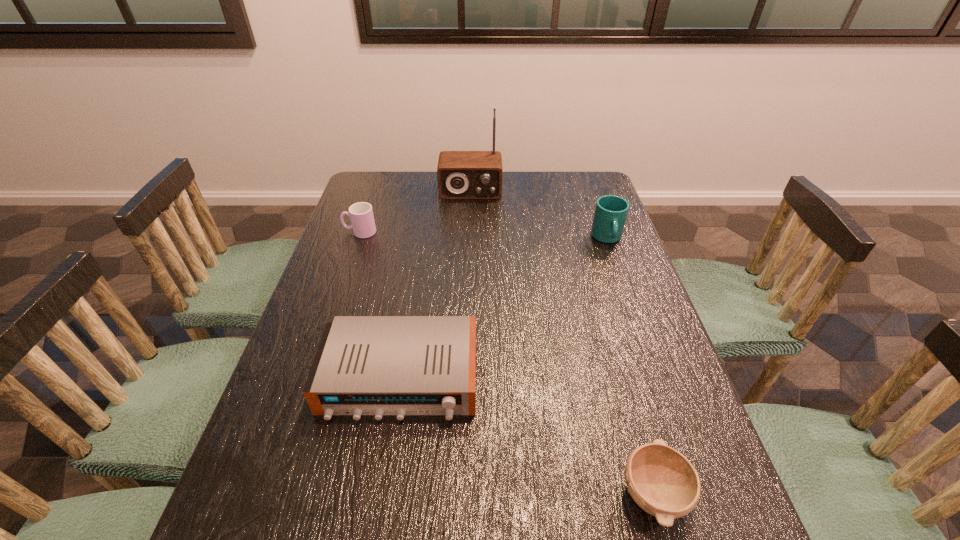
The height and width of the screenshot is (540, 960). What are the coordinates of `vacant space that's between the taller cup and the bowl` in the screenshot? It's located at (630, 366).

This screenshot has height=540, width=960. What are the coordinates of `free space between the left cup and the farther radio receiver` in the screenshot? It's located at (416, 212).

Choose which object is the second nearest neighbor to the shorter radio receiver. Please provide its 2D coordinates. Your answer should be formatted as a tuple, i.e. [(x, y)], where the tuple contains the x and y coordinates of a point satisfying the conditions above.

[(361, 214)]

Where is `object that is the closest to the nearest object`? This screenshot has height=540, width=960. object that is the closest to the nearest object is located at coordinates (365, 365).

In order to click on free space that satisfies the following two spatial constraints: 1. on the front-facing side of the nearest object; 2. on the right side of the farthest object in this screenshot , I will do `click(462, 494)`.